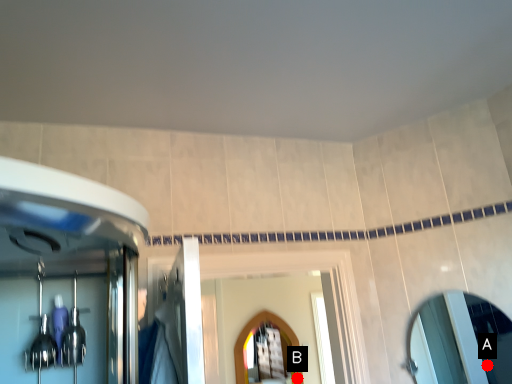
Question: Two points are circled on the image, labeled by A and B beside each circle. Which of the following is the farthest from the observer?

Choices:
 (A) A is further
 (B) B is further

Answer: (B)